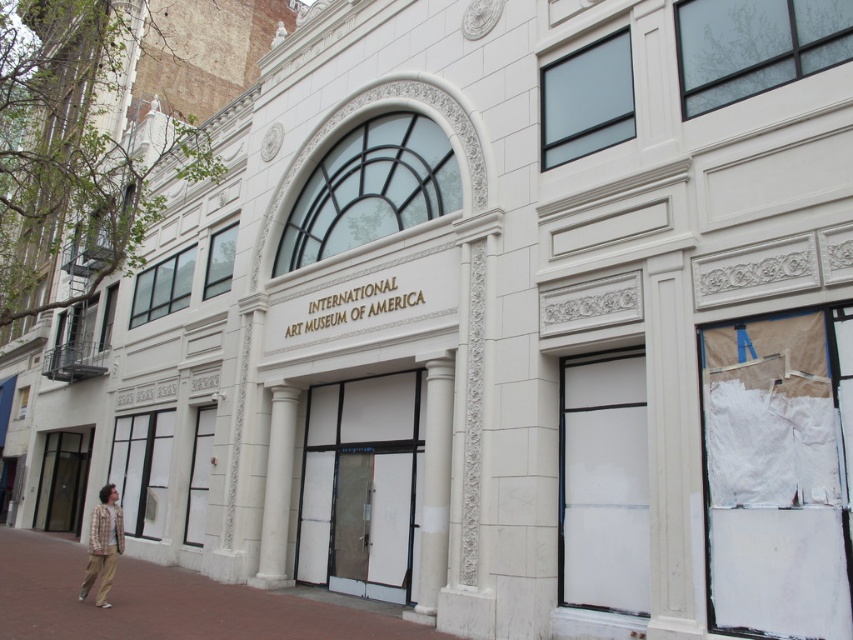
Is white marble column at center thinner than plaid shirt at lower left?

Incorrect, white marble column at center's width is not less than plaid shirt at lower left's.

Is white marble column at center taller than plaid shirt at lower left?

Correct, white marble column at center is much taller as plaid shirt at lower left.

Image resolution: width=853 pixels, height=640 pixels. I want to click on white marble column at center, so click(277, 490).

Does white marble pillar at center appear on the left side of plaid shirt at lower left?

In fact, white marble pillar at center is to the right of plaid shirt at lower left.

You are a GUI agent. You are given a task and a screenshot of the screen. Output one action in this format:
    pyautogui.click(x=<x>, y=<y>)
    Task: Click on the white marble pillar at center
    
    Given the screenshot: What is the action you would take?
    pyautogui.click(x=434, y=484)

Where is `white marble pillar at center`? The height and width of the screenshot is (640, 853). white marble pillar at center is located at coordinates (434, 484).

Who is positioned more to the right, white marble pillar at center or white marble column at center?

white marble pillar at center

In the scene shown: Is white marble pillar at center positioned in front of white marble column at center?

Yes.

Where is `white marble pillar at center`? The image size is (853, 640). white marble pillar at center is located at coordinates (434, 484).